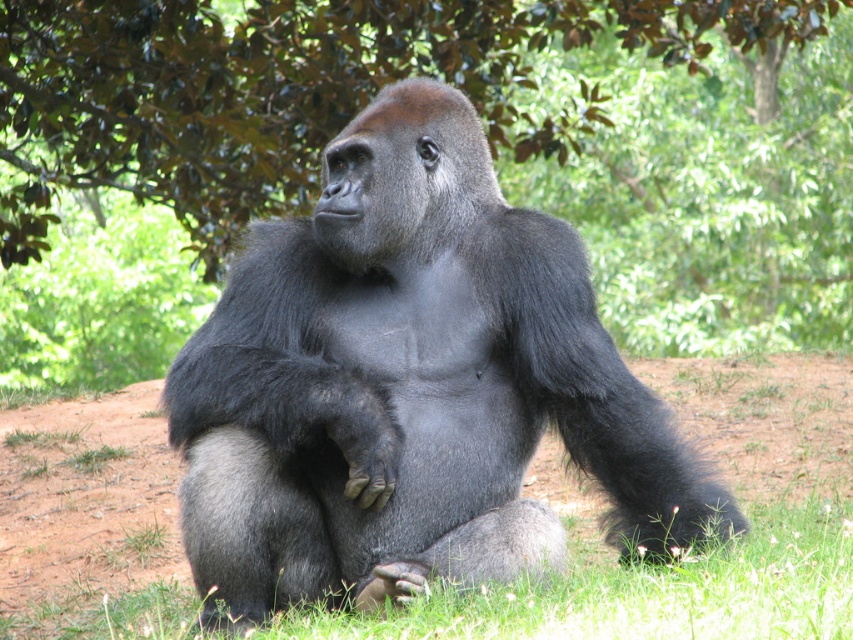
Which is in front, point (308, 51) or point (109, 435)?

Point (109, 435) is in front.

Can you confirm if green leafy tree at upper center is positioned below brown soil at center?

No, green leafy tree at upper center is not below brown soil at center.

Is point (668, 81) behind point (93, 474)?

That is True.

Where is `green leafy tree at upper center`? The height and width of the screenshot is (640, 853). green leafy tree at upper center is located at coordinates (485, 128).

Which is behind, point (233, 132) or point (665, 518)?

The point (233, 132) is more distant.

Who is positioned more to the left, green leafy tree at upper center or dark gray fur gorilla at center?

Positioned to the left is dark gray fur gorilla at center.

Between point (647, 253) and point (361, 504), which one is positioned behind?

The point (647, 253) is more distant.

At what (x,y) coordinates should I click in order to perform the action: click on green leafy tree at upper center. Please return your answer as a coordinate pair (x, y). Image resolution: width=853 pixels, height=640 pixels. Looking at the image, I should click on (485, 128).

Is dark gray fur gorilla at center bigger than brown soil at center?

Yes, dark gray fur gorilla at center is bigger than brown soil at center.

Consider the image. Which is more to the left, dark gray fur gorilla at center or brown soil at center?

From the viewer's perspective, dark gray fur gorilla at center appears more on the left side.

Who is more forward, (347, 310) or (671, 579)?

Point (671, 579) is in front.

Locate an element on the screen. The width and height of the screenshot is (853, 640). dark gray fur gorilla at center is located at coordinates (410, 387).